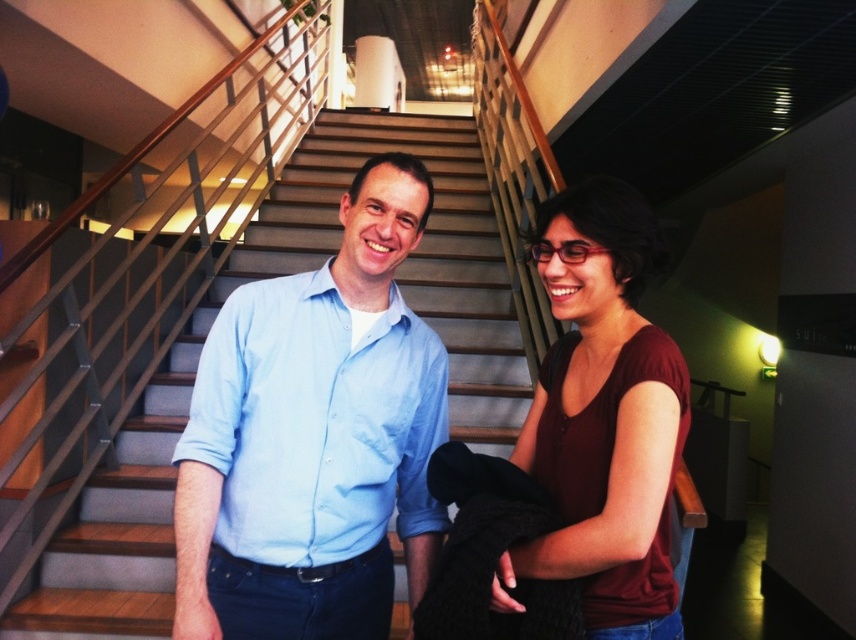
Identify the location of light blue shirt at center. (314, 436).

Where is `light blue shirt at center`? light blue shirt at center is located at coordinates click(x=314, y=436).

Identify the location of light blue shirt at center. (314, 436).

Which is in front, point (421, 316) or point (548, 349)?

Point (548, 349) is more forward.

Does wooden stairs at center come in front of matte burgundy shirt at center?

No.

Does point (137, 504) come behind point (571, 488)?

Yes, point (137, 504) is behind point (571, 488).

You are a GUI agent. You are given a task and a screenshot of the screen. Output one action in this format:
    pyautogui.click(x=<x>, y=<y>)
    Task: Click on the wooden stairs at center
    This screenshot has width=856, height=640.
    Given the screenshot: What is the action you would take?
    pyautogui.click(x=206, y=333)

Between light blue shirt at center and matte burgundy shirt at center, which one is positioned lower?

matte burgundy shirt at center is lower down.

The height and width of the screenshot is (640, 856). What do you see at coordinates (314, 436) in the screenshot? I see `light blue shirt at center` at bounding box center [314, 436].

Locate an element on the screen. The height and width of the screenshot is (640, 856). light blue shirt at center is located at coordinates (314, 436).